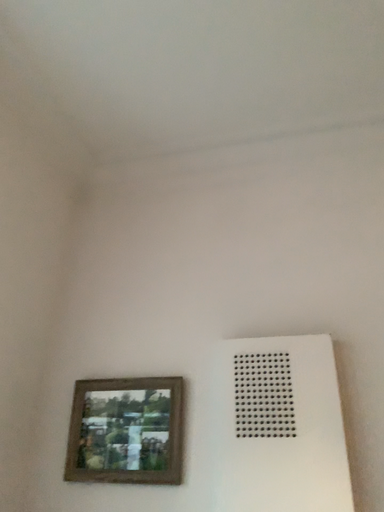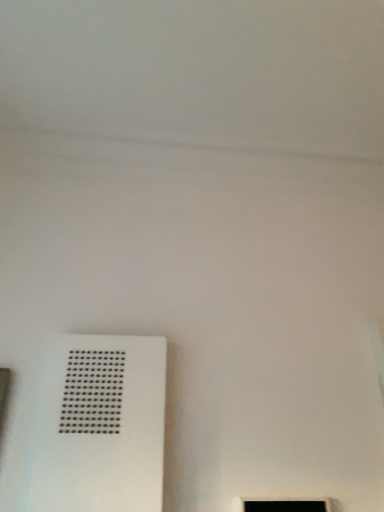
Question: Which way did the camera rotate in the video?

Choices:
 (A) rotated left
 (B) rotated right

Answer: (B)